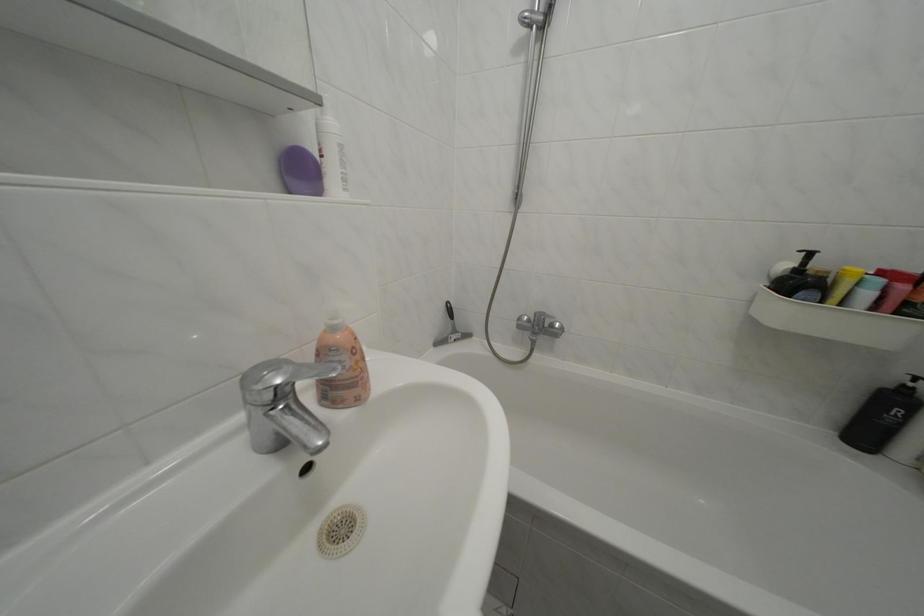
The width and height of the screenshot is (924, 616). What do you see at coordinates (912, 379) in the screenshot? I see `the black dispenser pump` at bounding box center [912, 379].